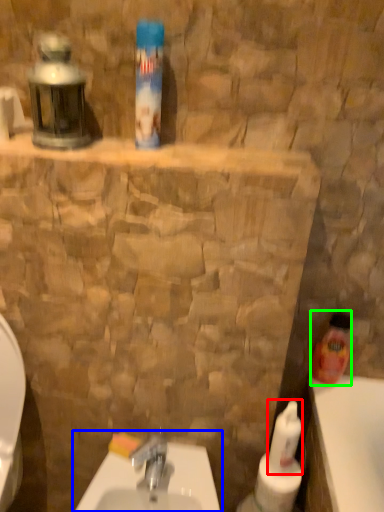
Question: Which object is positioned closest to cleaning product (highlighted by a red box)? Select from sink (highlighted by a blue box) and cleaning product (highlighted by a green box).

Choices:
 (A) sink
 (B) cleaning product

Answer: (B)